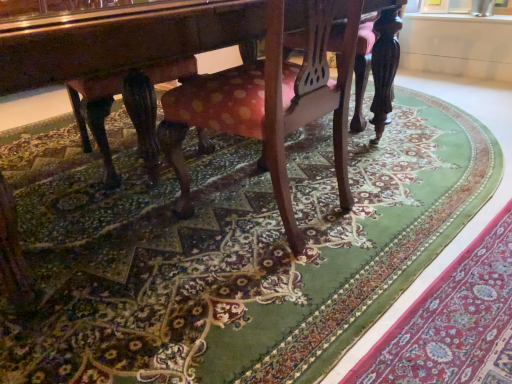
Question: In the image, is polka dot fabric chair at center positioned in front of or behind green carpet at lower right?

Choices:
 (A) behind
 (B) front

Answer: (A)

Question: In terms of size, does polka dot fabric chair at center appear bigger or smaller than green carpet at lower right?

Choices:
 (A) small
 (B) big

Answer: (B)

Question: From a real-world perspective, is polka dot fabric chair at center above or below green carpet at lower right?

Choices:
 (A) above
 (B) below

Answer: (A)

Question: Is point (480, 289) positioned closer to the camera than point (359, 16)?

Choices:
 (A) farther
 (B) closer

Answer: (B)

Question: In the image, is green carpet at lower right positioned in front of or behind polka dot fabric chair at center?

Choices:
 (A) front
 (B) behind

Answer: (A)

Question: From a real-world perspective, is green carpet at lower right above or below polka dot fabric chair at center?

Choices:
 (A) below
 (B) above

Answer: (A)

Question: In the image, is green carpet at lower right on the left side or the right side of polka dot fabric chair at center?

Choices:
 (A) right
 (B) left

Answer: (A)